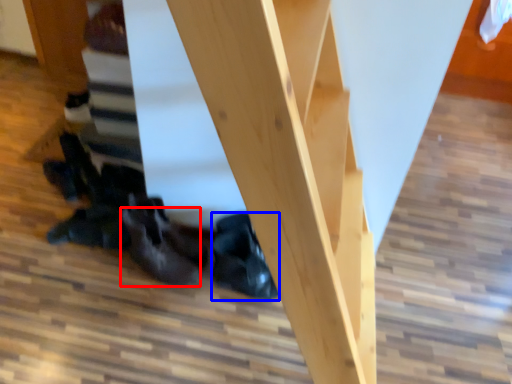
Question: Which of the following is the farthest to the observer, leather shoe (highlighted by a red box) or leather shoe (highlighted by a blue box)?

Choices:
 (A) leather shoe
 (B) leather shoe

Answer: (B)